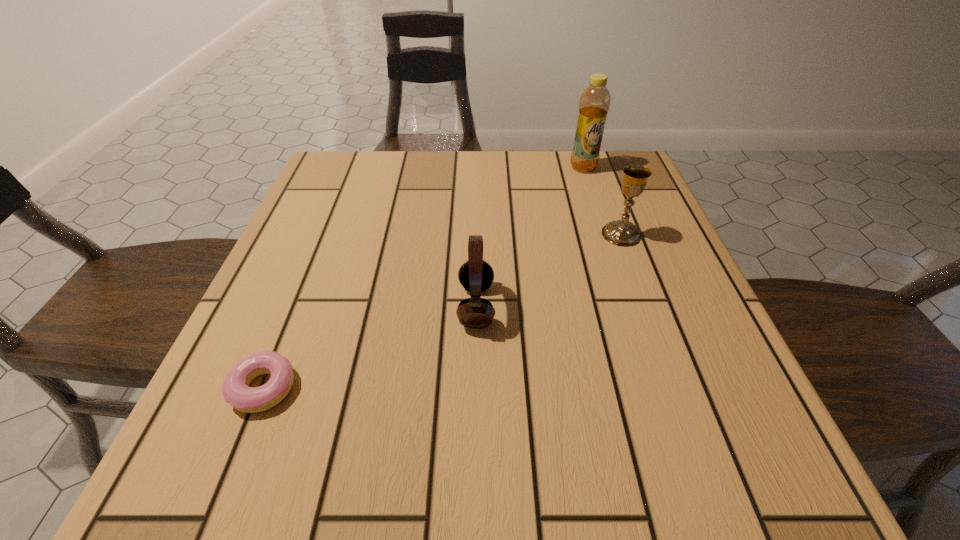
Where is `vacant space situated 0.100m on the back of the leftmost object`? The width and height of the screenshot is (960, 540). vacant space situated 0.100m on the back of the leftmost object is located at coordinates (294, 314).

You are a GUI agent. You are given a task and a screenshot of the screen. Output one action in this format:
    pyautogui.click(x=<x>, y=<y>)
    Task: Click on the object present at the far edge
    
    Given the screenshot: What is the action you would take?
    pyautogui.click(x=594, y=103)

Where is `object that is at the left edge`? object that is at the left edge is located at coordinates (236, 391).

Locate an element on the screen. This screenshot has width=960, height=540. bottle positioned at the right edge is located at coordinates (594, 103).

Identify the location of chalice located at the right edge. (622, 232).

Find the location of a particular element. The height and width of the screenshot is (540, 960). object at the far right corner is located at coordinates (594, 103).

Locate an element on the screen. The image size is (960, 540). vacant position at the far edge of the desktop is located at coordinates (467, 204).

I want to click on free point at the left edge, so click(343, 232).

In the image, there is a desktop. What are the coordinates of `free space at the right edge` in the screenshot? It's located at (660, 367).

At what (x,y) coordinates should I click in order to perform the action: click on vacant space at the far left corner of the desktop. Please return your answer as a coordinate pair (x, y). Looking at the image, I should click on (313, 184).